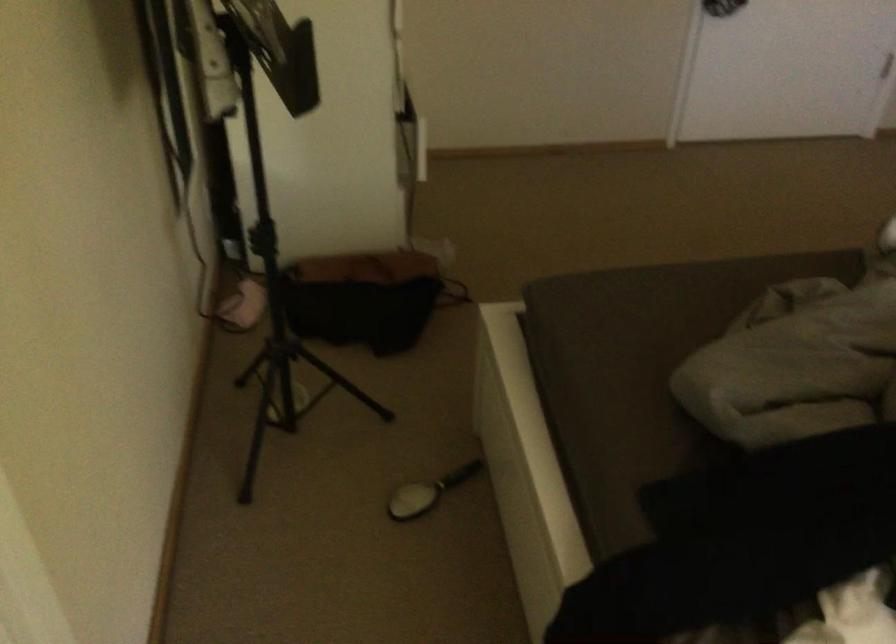
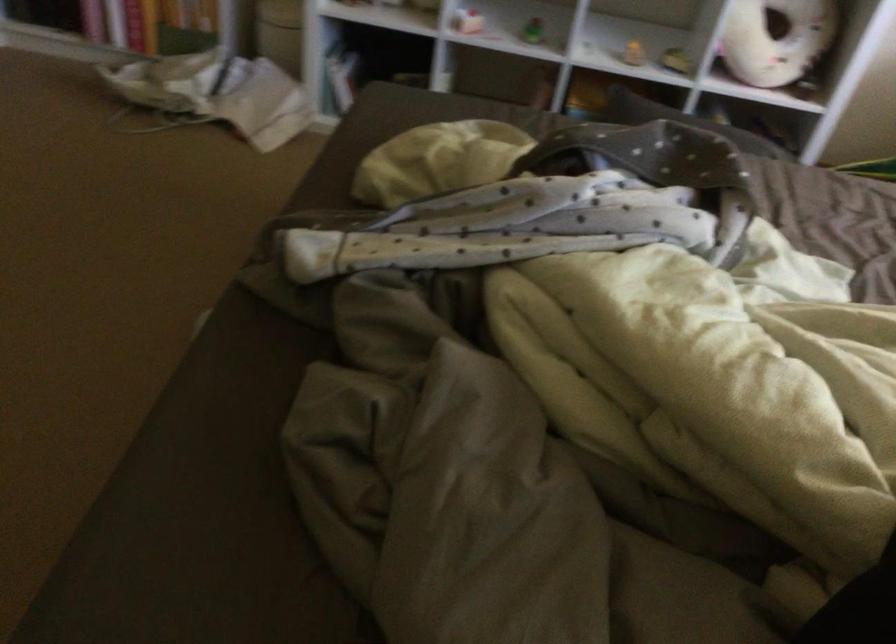
The images are taken continuously from a first-person perspective. In which direction is your viewpoint rotating?

The camera rotated toward right-down.